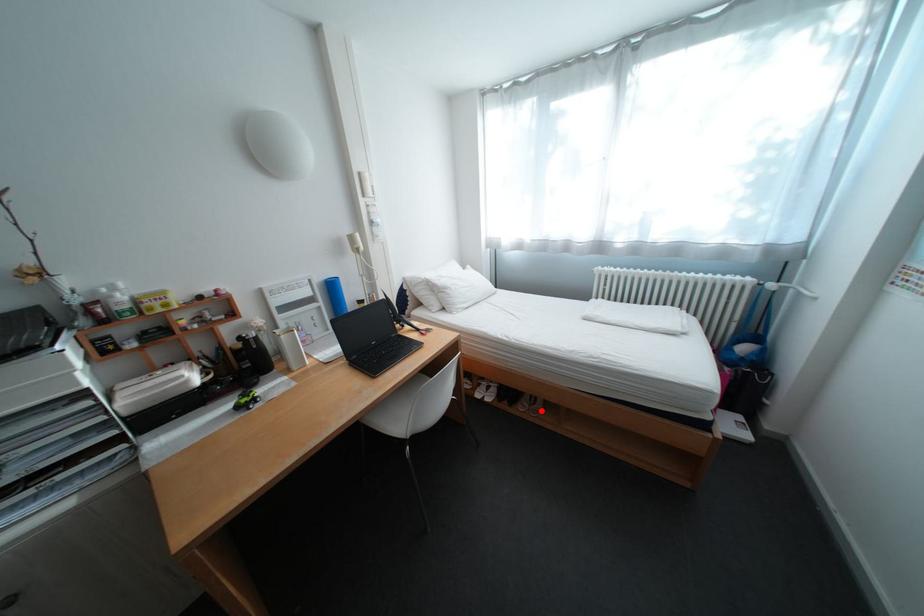
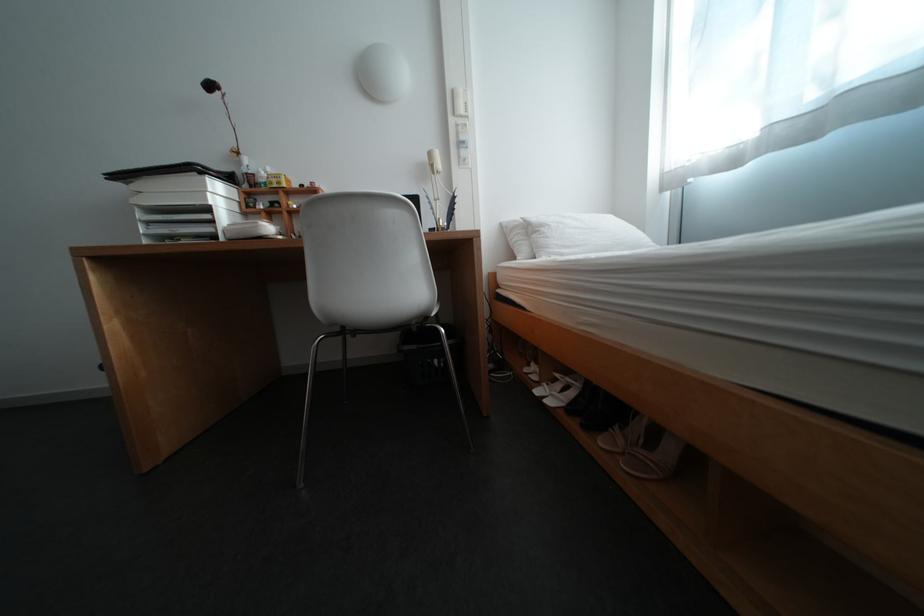
Find the pixel in the second image that matches the highlighted location in the first image.

(637, 455)